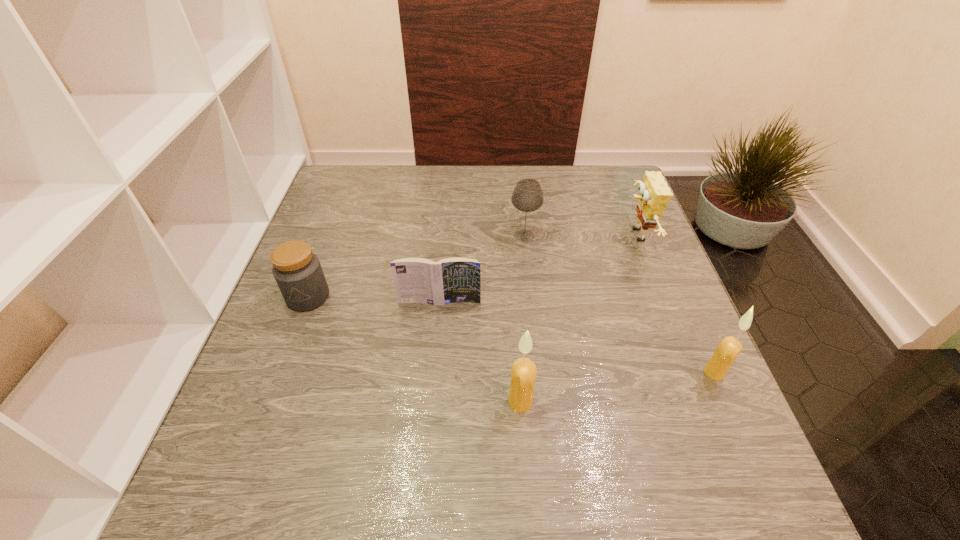
The height and width of the screenshot is (540, 960). In order to click on free location that satisfies the following two spatial constraints: 1. on the surface of the jar near the warning symbol; 2. on the left side of the nearest object in this screenshot , I will do `click(269, 402)`.